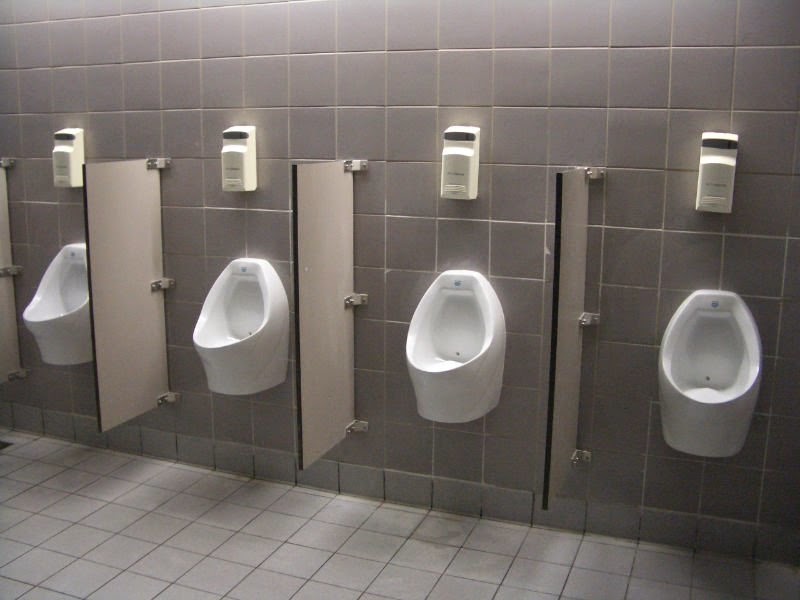
Locate an element on the screen. urinals toilets is located at coordinates (64, 306), (240, 355), (428, 382), (673, 399).